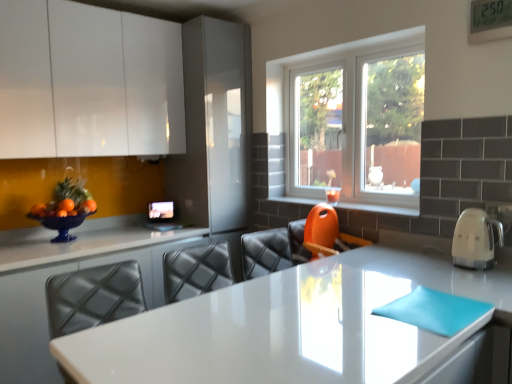
The width and height of the screenshot is (512, 384). I want to click on vacant space underneath white glossy kettle at right (from a real-world perspective), so click(485, 263).